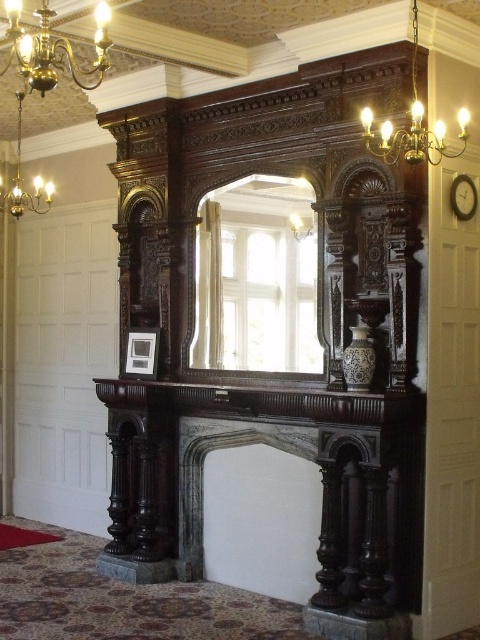
Question: Is dark wood fireplace at center thinner than matte white picture frame at center?

Choices:
 (A) no
 (B) yes

Answer: (A)

Question: Which of the following is the closest to the observer?

Choices:
 (A) gold brass chandelier at upper right
 (B) gold brass chandelier at upper left

Answer: (B)

Question: Considering the real-world distances, which object is closest to the polished wood mirror at center?

Choices:
 (A) dark wood fireplace at center
 (B) gold brass chandelier at upper right
 (C) matte white picture frame at center
 (D) matte gold lamp at upper center

Answer: (D)

Question: Can you confirm if gold brass chandelier at upper left is positioned above matte white picture frame at center?

Choices:
 (A) no
 (B) yes

Answer: (B)

Question: Considering the real-world distances, which object is closest to the matte white picture frame at center?

Choices:
 (A) gold brass chandelier at upper left
 (B) dark wood mantle at center
 (C) gold brass chandelier at upper right
 (D) matte gold lamp at upper center

Answer: (B)

Question: Where is dark wood mantle at center located in relation to gold brass chandelier at upper left in the image?

Choices:
 (A) below
 (B) above

Answer: (A)